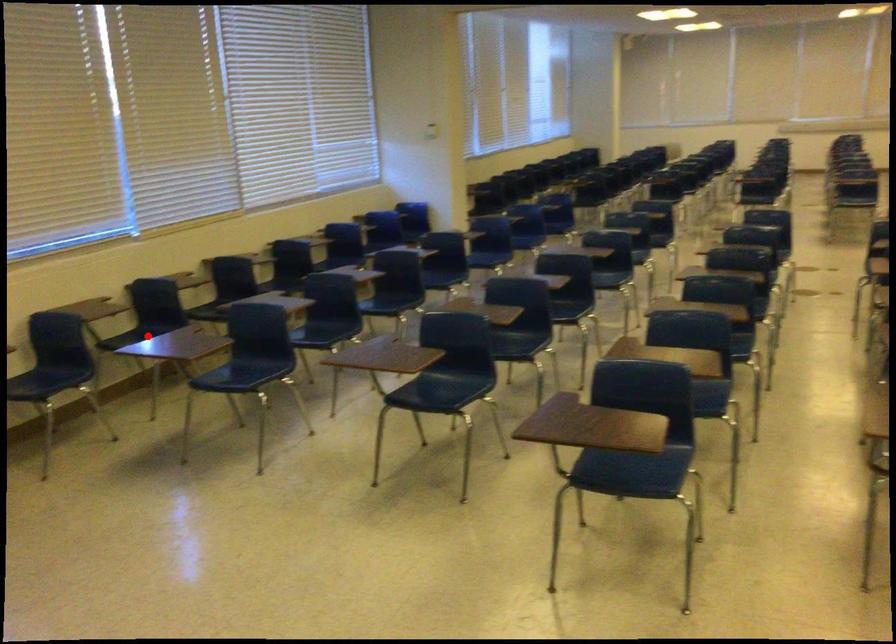
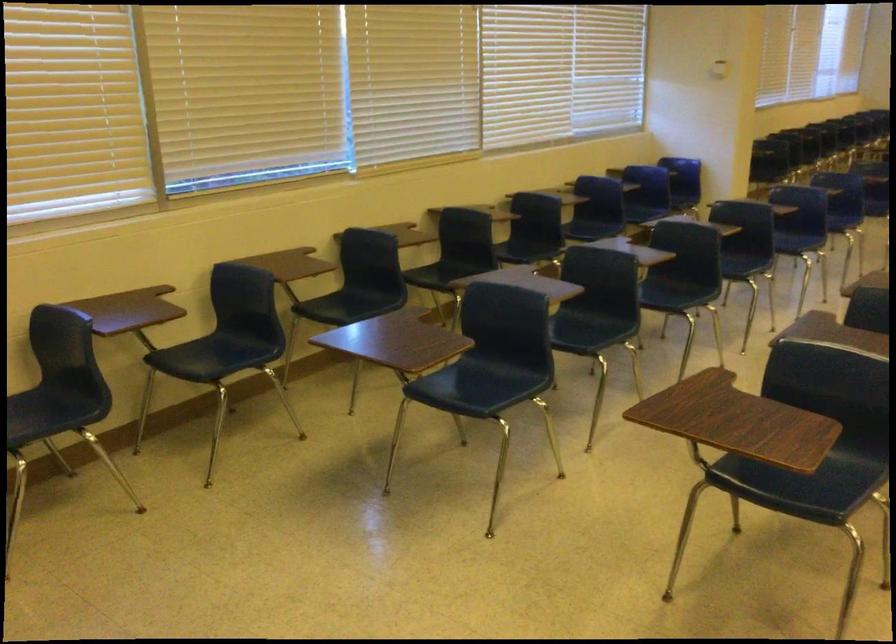
Question: I am providing you with two images of the same scene from different viewpoints. Image1 has a red point marked. In image2, the corresponding 3D location appears at what relative position? Reply with the corresponding letter.

Choices:
 (A) Closer
 (B) Farther

Answer: (A)